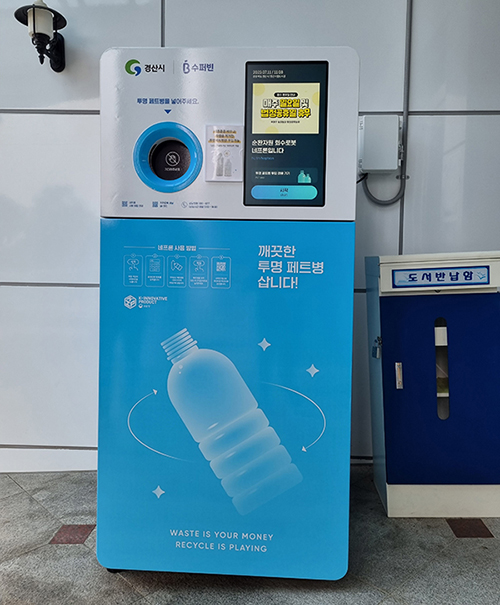
Where is `grey tile flooring`? The width and height of the screenshot is (500, 605). grey tile flooring is located at coordinates (6, 596), (10, 505), (75, 483), (72, 581), (212, 597), (391, 590), (408, 554), (487, 584).